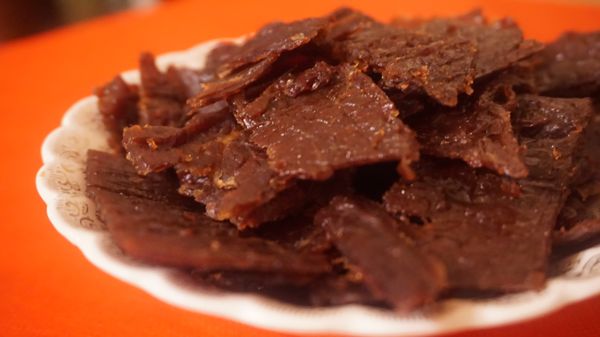
At what (x,y) coordinates should I click in order to perform the action: click on orange table. Please return your answer as a coordinate pair (x, y). Image resolution: width=600 pixels, height=337 pixels. Looking at the image, I should click on (80, 294).